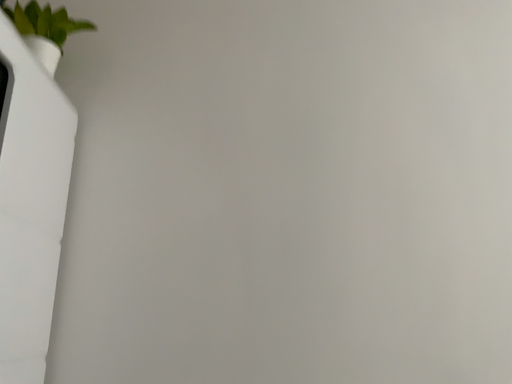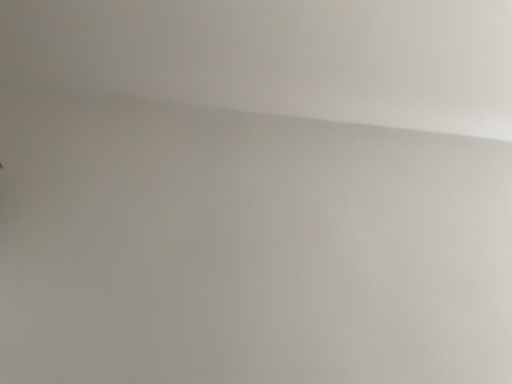
Question: How did the camera likely rotate when shooting the video?

Choices:
 (A) rotated right
 (B) rotated left

Answer: (A)